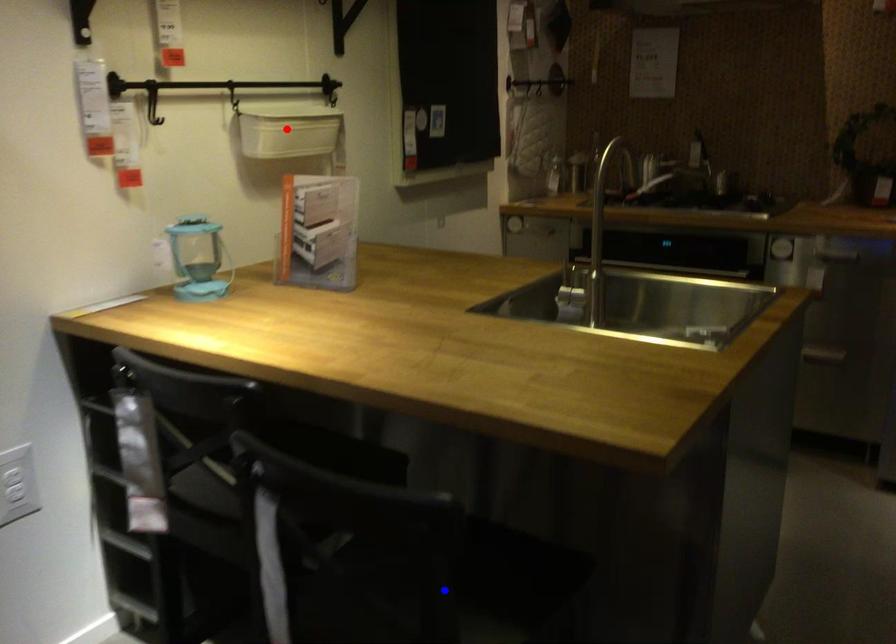
Question: Which of the two points in the image is closer to the camera?

Choices:
 (A) Blue point is closer.
 (B) Red point is closer.

Answer: (A)